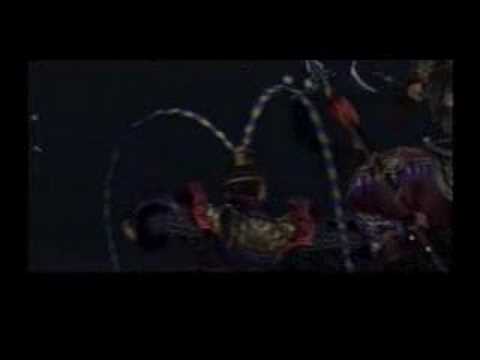
The width and height of the screenshot is (480, 360). I want to click on corner, so click(x=434, y=101).